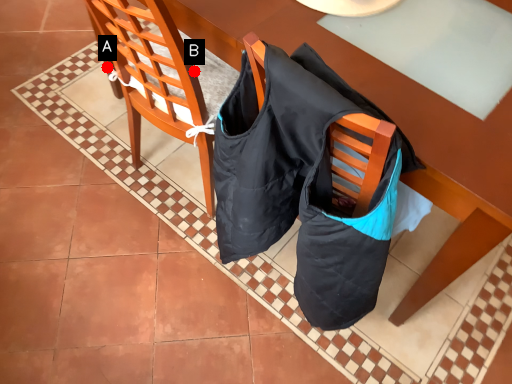
Question: Two points are circled on the image, labeled by A and B beside each circle. Which point appears closest to the camera in this image?

Choices:
 (A) A is closer
 (B) B is closer

Answer: (B)